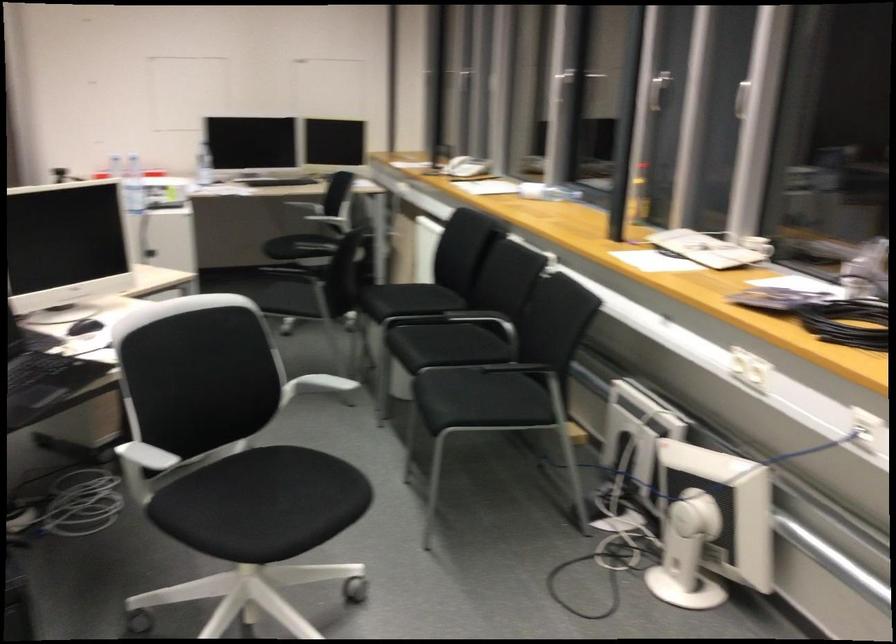
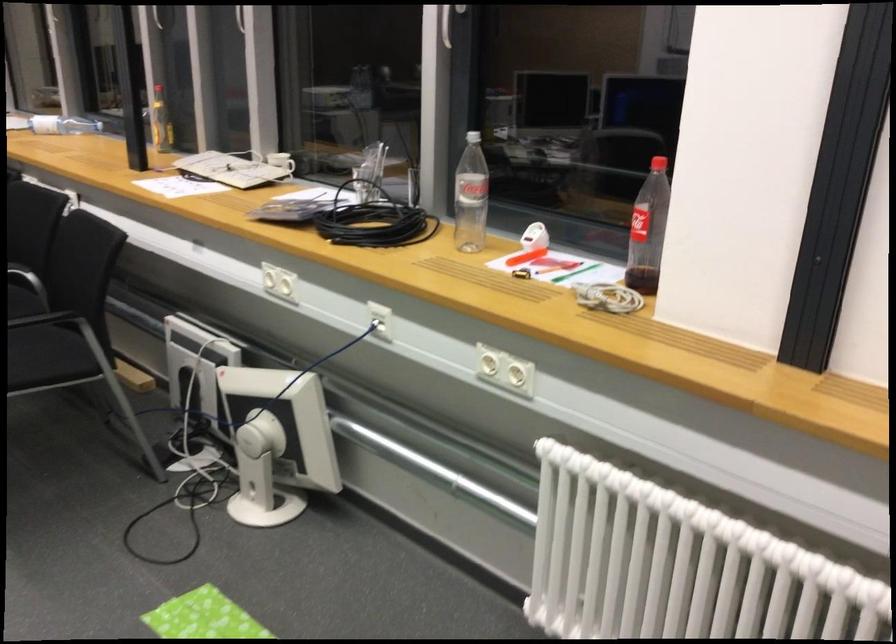
Which direction would the cameraman need to move to produce the second image?

The cameraman walked toward right, backward.